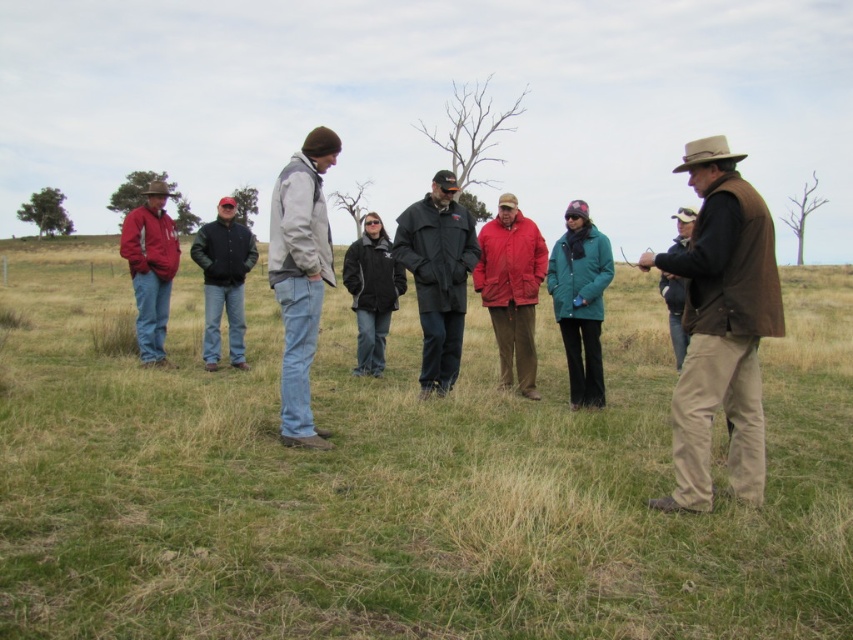
Which is behind, point (292, 250) or point (152, 333)?

The point (152, 333) is more distant.

Between light gray jacket at center and matte red jacket at left, which one is positioned higher?

matte red jacket at left is higher up.

Between point (287, 362) and point (157, 248), which one is positioned in front?

Positioned in front is point (287, 362).

The width and height of the screenshot is (853, 640). Identify the location of light gray jacket at center. (300, 276).

Is point (421, 232) positioned behind point (498, 360)?

That is False.

Is black matte jacket at center shorter than red matte jacket at center?

No.

Where is `black matte jacket at center`? The height and width of the screenshot is (640, 853). black matte jacket at center is located at coordinates (438, 275).

Which is above, black matte jacket at center or dark green leather jacket at center?

dark green leather jacket at center

Which is more to the right, black matte jacket at center or dark green leather jacket at center?

black matte jacket at center

Is point (457, 307) positioned in front of point (223, 214)?

Yes, point (457, 307) is closer to viewer.

This screenshot has width=853, height=640. In order to click on black matte jacket at center in this screenshot , I will do `click(438, 275)`.